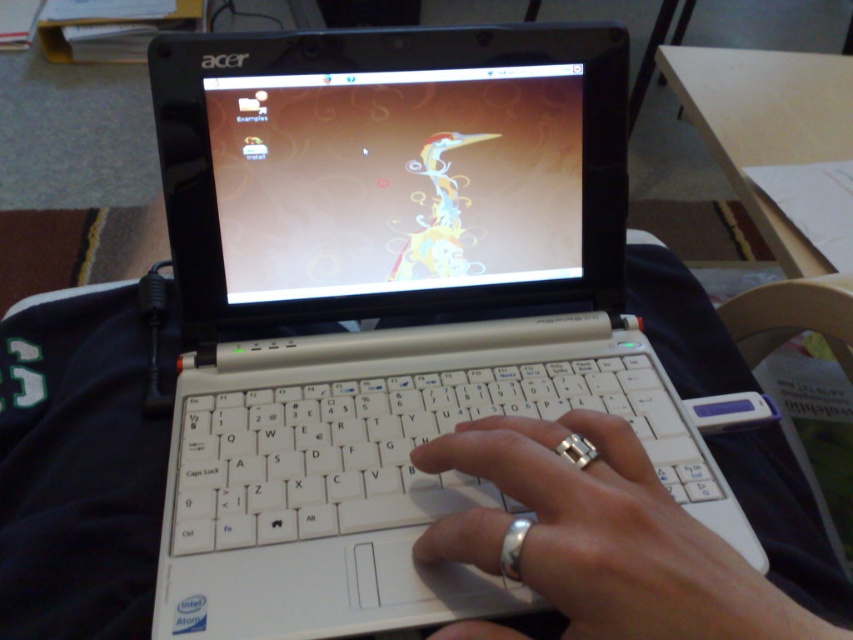
Is point (538, 81) positioned after point (328, 512)?

Yes.

Is point (311, 285) closer to viewer compared to point (236, 452)?

No, it is not.

Where is `matte plastic screen at center`? matte plastic screen at center is located at coordinates (395, 179).

Does white plastic laptop at center have a greater width compared to silver metallic ring at center?

Yes.

Which of these two, white plastic laptop at center or silver metallic ring at center, stands taller?

Standing taller between the two is white plastic laptop at center.

Which is in front, point (537, 337) or point (491, 464)?

Point (491, 464)

Locate an element on the screen. white plastic laptop at center is located at coordinates (387, 308).

Which is more to the left, white plastic laptop at center or matte plastic screen at center?

matte plastic screen at center is more to the left.

Who is positioned more to the right, white plastic laptop at center or matte plastic screen at center?

white plastic laptop at center is more to the right.

This screenshot has width=853, height=640. I want to click on white plastic laptop at center, so click(x=387, y=308).